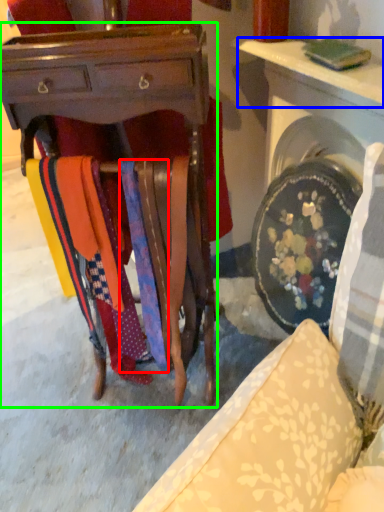
Question: Estimate the real-world distances between objects in this image. Which object is closer to tie (highlighted by a red box), table (highlighted by a blue box) or desk (highlighted by a green box)?

Choices:
 (A) table
 (B) desk

Answer: (B)